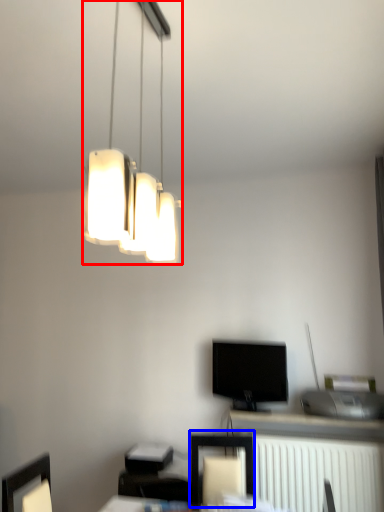
Question: Which of the following is the farthest to the observer, lamp (highlighted by a red box) or furniture (highlighted by a blue box)?

Choices:
 (A) lamp
 (B) furniture

Answer: (B)